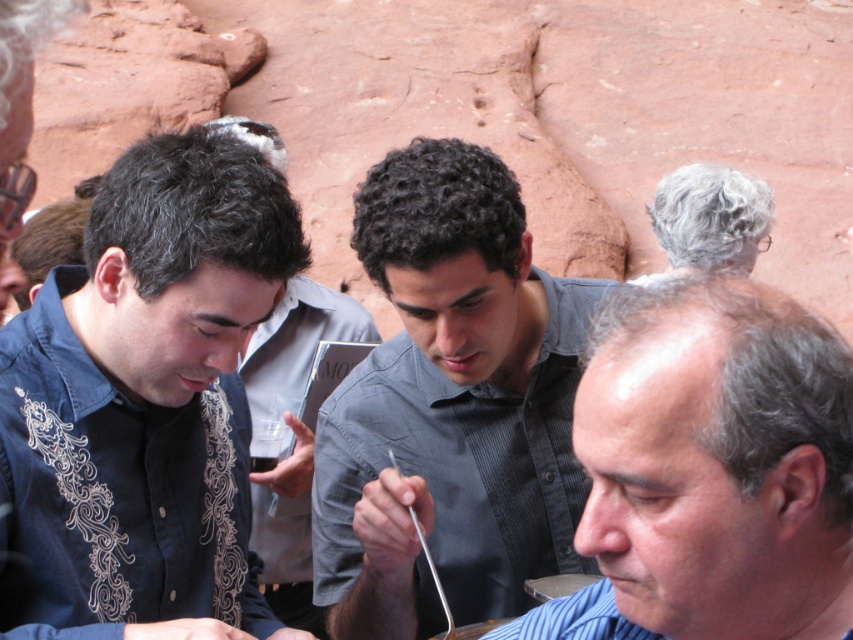
You are a photographer at this outdoor gathering. You need to place a large banner between the dark blue denim shirt at left and the dark blue shirt at center. Which side of the banner should you align with the wider shirt?

The dark blue denim shirt at left is wider than the dark blue shirt at center. Therefore, you should align the banner so that its left side matches the width of the dark blue denim shirt at left to ensure proper placement.

Looking at this image, you are a photographer trying to capture a photo of the dark blue denim shirt at left and the dark blue shirt at center. Based on their positions, which one will appear closer to the top of the photo?

The dark blue denim shirt at left is located above the dark blue shirt at center, so it will appear closer to the top of the photo.

You are a photographer trying to capture a photo of the two men in the scene. Since you want to ensure both subjects are in frame, can you determine if the dark blue denim shirt at left and the gray textured shirt at center are positioned side by side?

The dark blue denim shirt at left is positioned on the left side of gray textured shirt at center, so yes, they are positioned side by side.